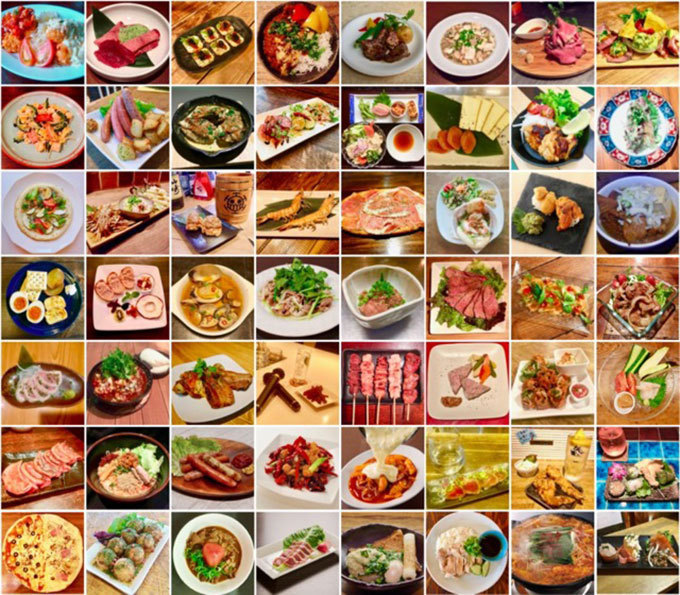
The width and height of the screenshot is (680, 595). I want to click on top row of pictures, so click(37, 40), click(135, 43), click(198, 42), click(451, 42), click(539, 39), click(626, 37), click(377, 45), click(301, 61).